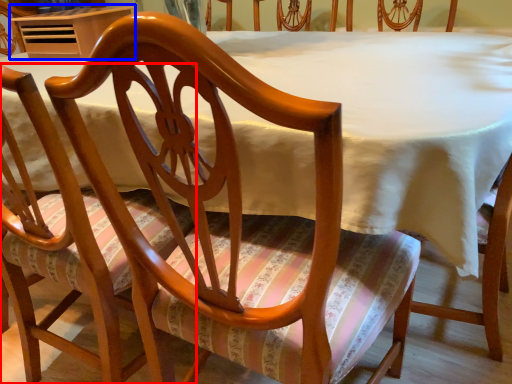
Question: Among these objects, which one is nearest to the camera, chair (highlighted by a red box) or table (highlighted by a blue box)?

Choices:
 (A) chair
 (B) table

Answer: (A)